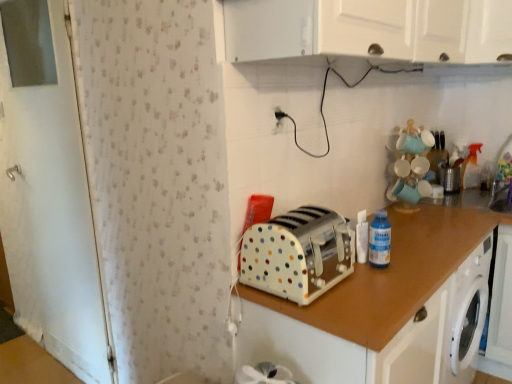
Identify the location of vacant space to the right of white polka dot plastic toaster at center. [371, 283].